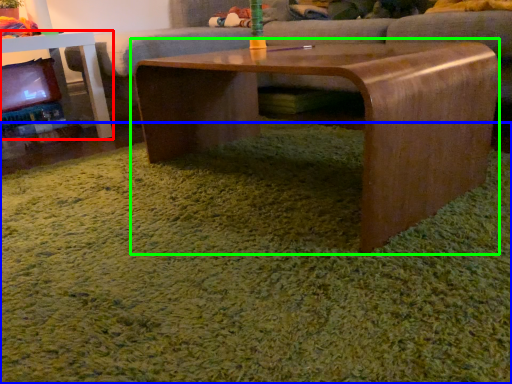
Question: Which is farther away from table (highlighted by a red box)? grass (highlighted by a blue box) or coffee table (highlighted by a green box)?

Choices:
 (A) grass
 (B) coffee table

Answer: (A)